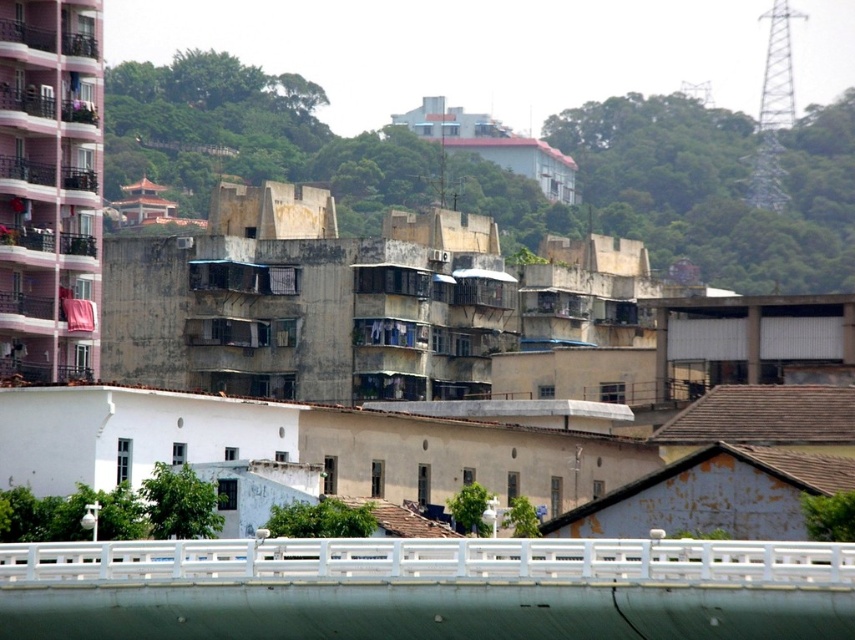
You are a city planner analyzing this urban area. You need to determine which structure is larger in size between the white concrete bridge at lower center and the white matte overpass at right. Based on the scene, which one is bigger?

The white matte overpass at right is larger than the white concrete bridge at lower center according to the description.

You are a delivery drone flying over an urban area and need to land on the white concrete bridge at lower center. However, there is a white matte overpass at right above it. Will the overpass block your landing path?

The white concrete bridge at lower center is located below the white matte overpass at right, so the overpass will block the landing path.

You are a delivery truck driver who needs to pass through either the white concrete bridge at lower center or the white matte overpass at right. Your truck is 3 meters wide. Which path can you safely take?

The white concrete bridge at lower center has a greater width than the white matte overpass at right. Since your truck is 3 meters wide, you should choose the white concrete bridge at lower center as it can accommodate the truck safely.